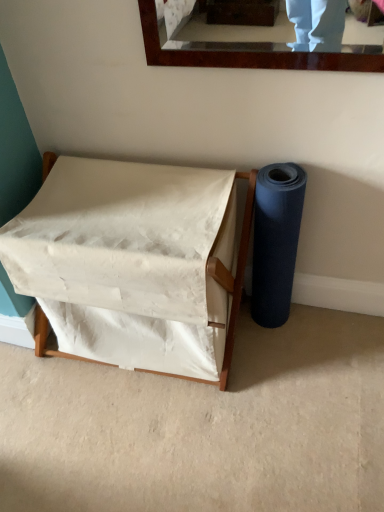
Locate an element on the screen. white fabric hamper at center is located at coordinates (133, 264).

Describe the element at coordinates (133, 264) in the screenshot. This screenshot has height=512, width=384. I see `white fabric hamper at center` at that location.

At what (x,y) coordinates should I click in order to perform the action: click on blue rubber mat at right. Please return your answer as a coordinate pair (x, y). Looking at the image, I should click on (276, 241).

What do you see at coordinates (276, 241) in the screenshot? I see `blue rubber mat at right` at bounding box center [276, 241].

This screenshot has width=384, height=512. Find the location of `white fabric hamper at center`. white fabric hamper at center is located at coordinates click(x=133, y=264).

Is white fabric hamper at center to the left of blue rubber mat at right from the viewer's perspective?

Indeed, white fabric hamper at center is positioned on the left side of blue rubber mat at right.

Is the depth of white fabric hamper at center less than that of blue rubber mat at right?

Yes, white fabric hamper at center is in front of blue rubber mat at right.

Does point (52, 229) appear closer or farther from the camera than point (259, 303)?

Point (52, 229) is positioned closer to the camera compared to point (259, 303).

Based on the photo, from the image's perspective, who appears lower, white fabric hamper at center or blue rubber mat at right?

white fabric hamper at center appears lower in the image.

From a real-world perspective, is white fabric hamper at center physically located above or below blue rubber mat at right?

white fabric hamper at center is situated lower than blue rubber mat at right in the real world.

Which object is wider, white fabric hamper at center or blue rubber mat at right?

With larger width is white fabric hamper at center.

Who is shorter, white fabric hamper at center or blue rubber mat at right?

Answer: white fabric hamper at center is shorter.

In the scene shown: Which of these two, white fabric hamper at center or blue rubber mat at right, is smaller?

With smaller size is blue rubber mat at right.

Is white fabric hamper at center located outside blue rubber mat at right?

white fabric hamper at center lies outside blue rubber mat at right's area.

Is white fabric hamper at center beside blue rubber mat at right?

white fabric hamper at center and blue rubber mat at right are not in contact.

Is white fabric hamper at center oriented away from blue rubber mat at right?

No, blue rubber mat at right is not at the back of white fabric hamper at center.

From the picture: How different are the orientations of white fabric hamper at center and blue rubber mat at right in degrees?

The angle between the facing direction of white fabric hamper at center and the facing direction of blue rubber mat at right is 0.00117 degrees.

You are a GUI agent. You are given a task and a screenshot of the screen. Output one action in this format:
    pyautogui.click(x=<x>, y=<y>)
    Task: Click on the furniture in front of the blue rubber mat at right
    
    Given the screenshot: What is the action you would take?
    pyautogui.click(x=133, y=264)

Considering the relative positions of blue rubber mat at right and white fabric hamper at center in the image provided, is blue rubber mat at right to the left of white fabric hamper at center from the viewer's perspective?

No.

Is the position of blue rubber mat at right more distant than that of white fabric hamper at center?

Yes, the depth of blue rubber mat at right is greater than that of white fabric hamper at center.

From the picture: Which is more distant, (296, 204) or (164, 311)?

The point (296, 204) is farther.

From the image's perspective, is blue rubber mat at right beneath white fabric hamper at center?

Actually, blue rubber mat at right appears above white fabric hamper at center in the image.

From a real-world perspective, is blue rubber mat at right physically above white fabric hamper at center?

Yes.

Considering the sizes of blue rubber mat at right and white fabric hamper at center in the image, is blue rubber mat at right wider or thinner than white fabric hamper at center?

In the image, blue rubber mat at right appears to be more narrow than white fabric hamper at center.

Who is shorter, blue rubber mat at right or white fabric hamper at center?

white fabric hamper at center is shorter.

Who is bigger, blue rubber mat at right or white fabric hamper at center?

With larger size is white fabric hamper at center.

Can white fabric hamper at center be found inside blue rubber mat at right?

That's incorrect, white fabric hamper at center is not inside blue rubber mat at right.

Would you say blue rubber mat at right is a long distance from white fabric hamper at center?

No, there isn't a large distance between blue rubber mat at right and white fabric hamper at center.

Could you tell me if blue rubber mat at right is facing white fabric hamper at center?

No, blue rubber mat at right is not facing towards white fabric hamper at center.

What's the angular difference between blue rubber mat at right and white fabric hamper at center's facing directions?

The angle between the facing direction of blue rubber mat at right and the facing direction of white fabric hamper at center is 0.00117 degrees.

This screenshot has width=384, height=512. Identify the location of furniture below the blue rubber mat at right (from the image's perspective). (133, 264).

Where is `furniture in front of the blue rubber mat at right`? furniture in front of the blue rubber mat at right is located at coordinates (133, 264).

This screenshot has height=512, width=384. There is a white fabric hamper at center. What are the coordinates of `toilet paper above it (from a real-world perspective)` in the screenshot? It's located at (276, 241).